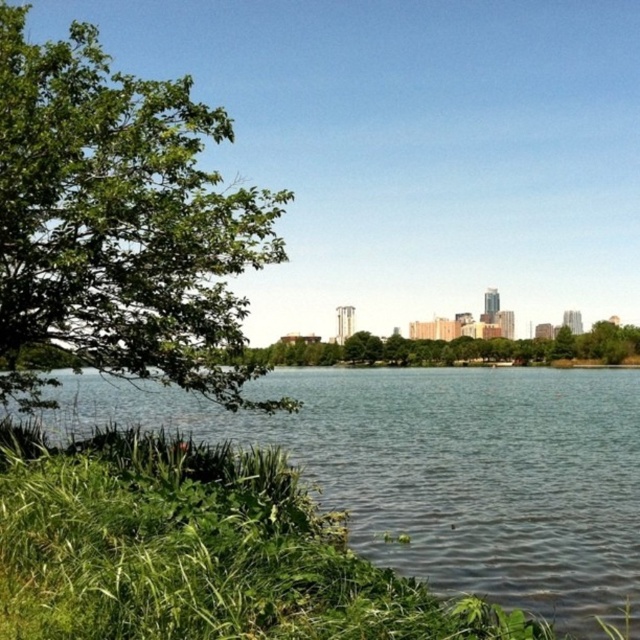
Question: From the image, what is the correct spatial relationship of green liquid water at lower left in relation to green leafy tree at left?

Choices:
 (A) left
 (B) right

Answer: (B)

Question: Is green liquid water at lower left closer to camera compared to green leafy tree at left?

Choices:
 (A) no
 (B) yes

Answer: (B)

Question: Is the position of green liquid water at lower left less distant than that of green leafy tree at left?

Choices:
 (A) no
 (B) yes

Answer: (B)